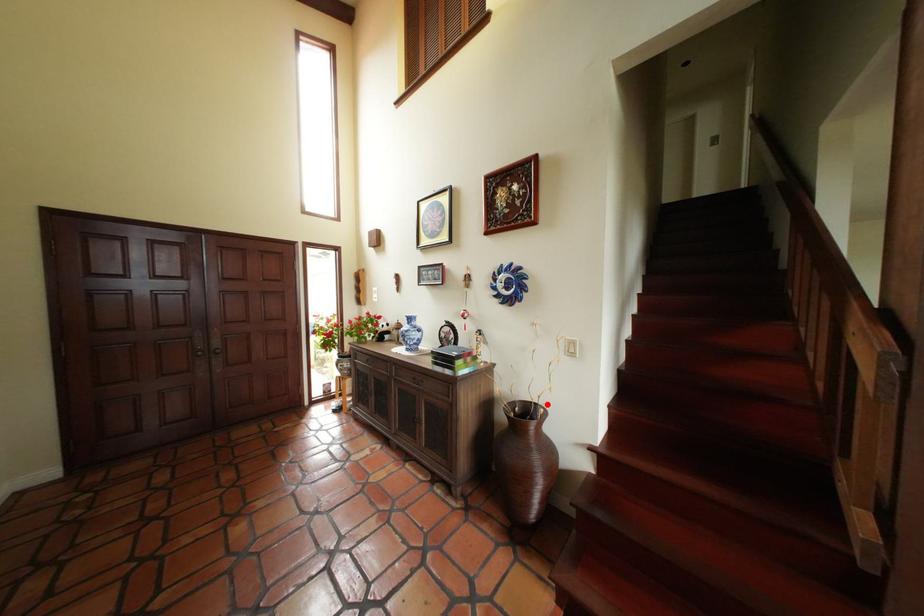
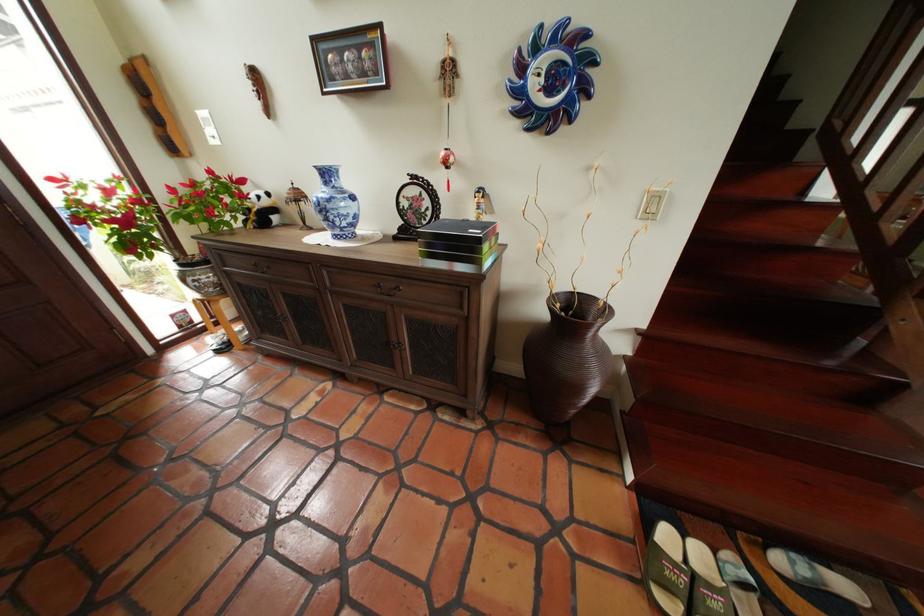
In the second image, find the point that corresponds to the highlighted location in the first image.

(590, 294)